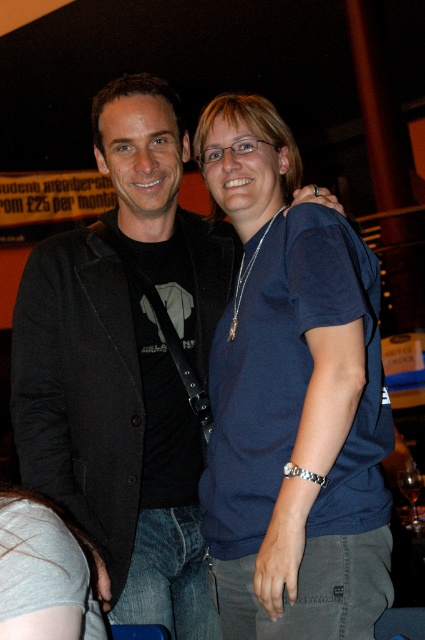
You are a photographer at an event and notice two shirts in the frame, the blue cotton shirt at center and the gray cotton shirt at lower left. Which shirt is covering part of the other?

The blue cotton shirt at center is positioned over gray cotton shirt at lower left, so it is covering part of the gray cotton shirt at lower left.

You are standing in a dimly lit indoor space and see the black matte jacket at center. If you want to reach into your pocket to retrieve your phone without moving your body, which direction should you face to ensure your hand can reach the pocket closest to the jacket?

Since the black matte jacket at center is 4.74 feet from the viewer, you should face towards the jacket to ensure your hand can reach the pocket closest to it.

You are standing at the entrance of the room and want to locate the black matte jacket at center. Which direction should you move to reach it?

The black matte jacket at center is located at point [110,429], so you should move towards the right and forward to reach it.